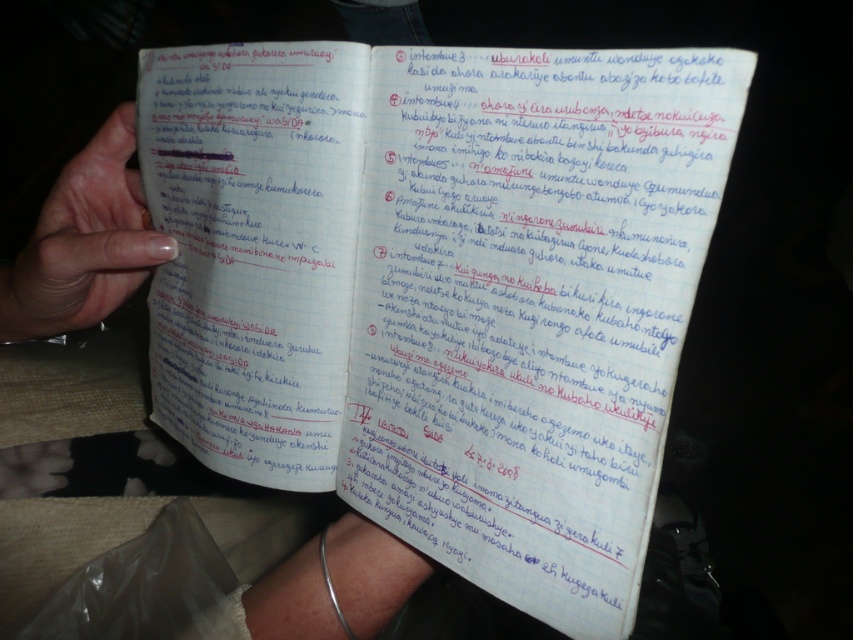
Looking at this image, is white lined paper at center shorter than nail polish at left?

In fact, white lined paper at center may be taller than nail polish at left.

Does point (595, 77) come behind point (114, 145)?

That is False.

Identify the location of white lined paper at center. (440, 289).